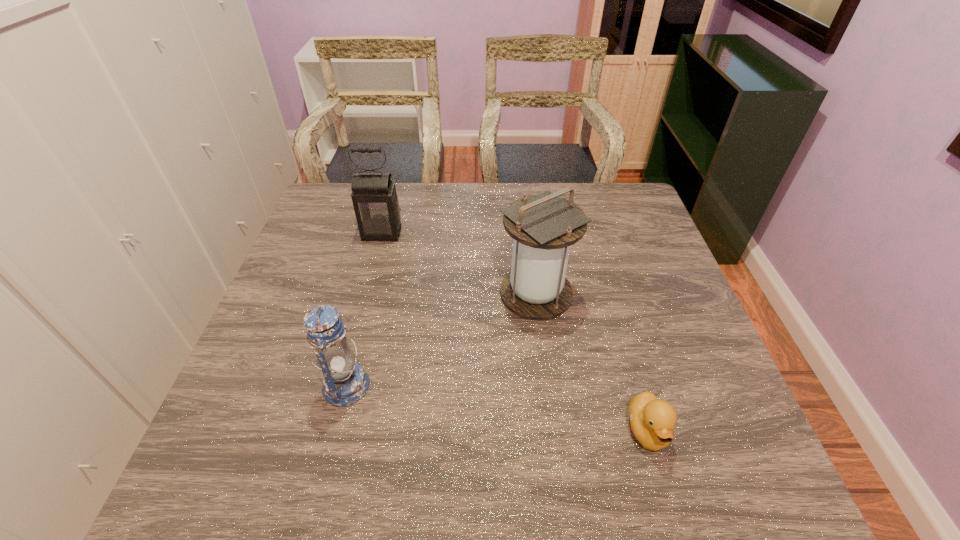
Find the location of a particular element. free space between the rightmost object and the third nearest object is located at coordinates (591, 362).

Locate an element on the screen. The height and width of the screenshot is (540, 960). unoccupied position between the duckling and the nearest lantern is located at coordinates point(497,408).

At what (x,y) coordinates should I click in order to perform the action: click on free space between the second farthest lantern and the nearest lantern. Please return your answer as a coordinate pair (x, y). The image size is (960, 540). Looking at the image, I should click on (441, 340).

Image resolution: width=960 pixels, height=540 pixels. I want to click on vacant point located between the third nearest object and the rightmost object, so click(x=591, y=362).

Identify the location of unoccupied position between the farthest lantern and the nearest lantern. This screenshot has width=960, height=540. (364, 309).

Where is `free space between the farthest object and the duckling`? The height and width of the screenshot is (540, 960). free space between the farthest object and the duckling is located at coordinates (515, 332).

The image size is (960, 540). Identify the location of empty location between the rightmost lantern and the nearest lantern. (x=441, y=340).

Identify which object is the closest to the rightmost object. Please provide its 2D coordinates. Your answer should be formatted as a tuple, i.e. [(x, y)], where the tuple contains the x and y coordinates of a point satisfying the conditions above.

[(544, 226)]

This screenshot has height=540, width=960. What are the coordinates of `object that is the second closest one to the shortest object` in the screenshot? It's located at (345, 382).

Locate an element on the screen. The width and height of the screenshot is (960, 540). lantern that is the second nearest to the nearest lantern is located at coordinates (375, 201).